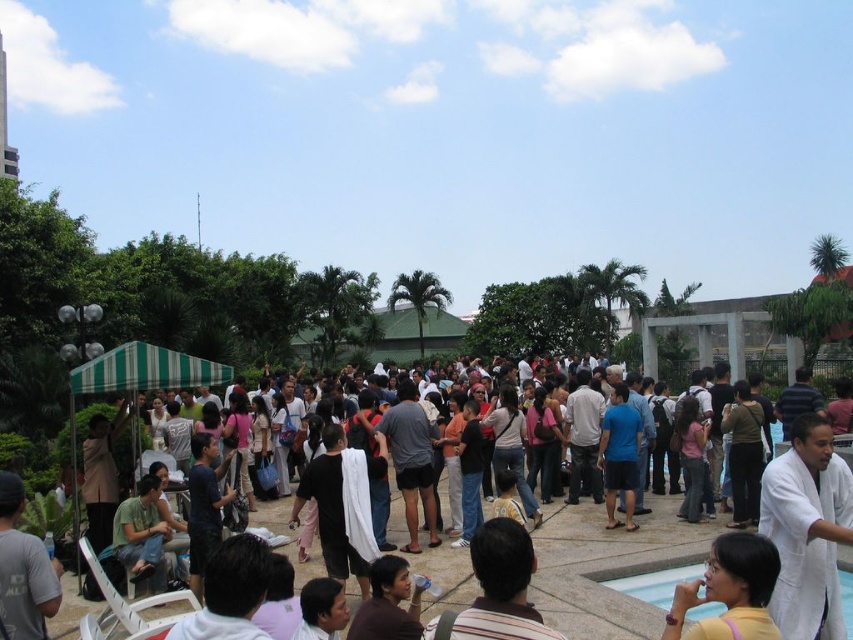
Question: Which object is farther from the camera taking this photo?

Choices:
 (A) white cloth at center
 (B) white matte coat at center
 (C) matte yellow shirt at lower right
 (D) white stone pool at lower right

Answer: (D)

Question: Is white cloth at center below white stone pool at lower right?

Choices:
 (A) yes
 (B) no

Answer: (B)

Question: Which object is positioned farthest from the white stone pool at lower right?

Choices:
 (A) white matte coat at center
 (B) matte yellow shirt at lower right
 (C) white cloth at center

Answer: (B)

Question: Can you confirm if white cloth at center is positioned above matte yellow shirt at lower right?

Choices:
 (A) no
 (B) yes

Answer: (A)

Question: Which of the following is the farthest from the observer?

Choices:
 (A) (820, 426)
 (B) (682, 554)
 (C) (653, 564)

Answer: (B)

Question: Is white matte coat at center positioned before matte yellow shirt at lower right?

Choices:
 (A) yes
 (B) no

Answer: (B)